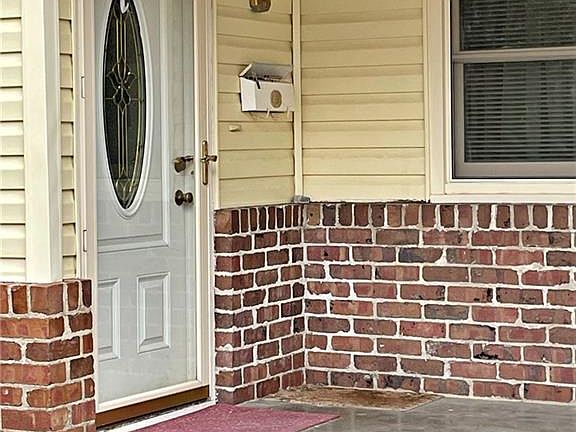
The width and height of the screenshot is (576, 432). In order to click on handle in this screenshot , I will do `click(190, 201)`.